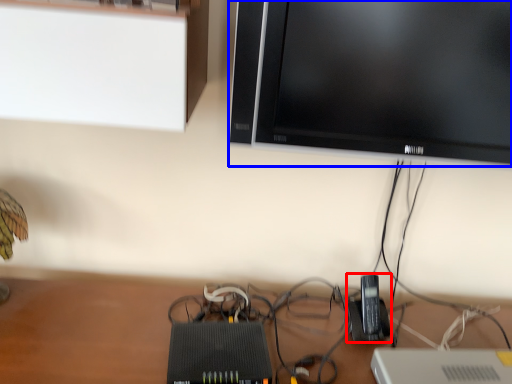
Question: Which object appears closest to the camera in this image, gadget (highlighted by a red box) or television (highlighted by a blue box)?

Choices:
 (A) gadget
 (B) television

Answer: (B)